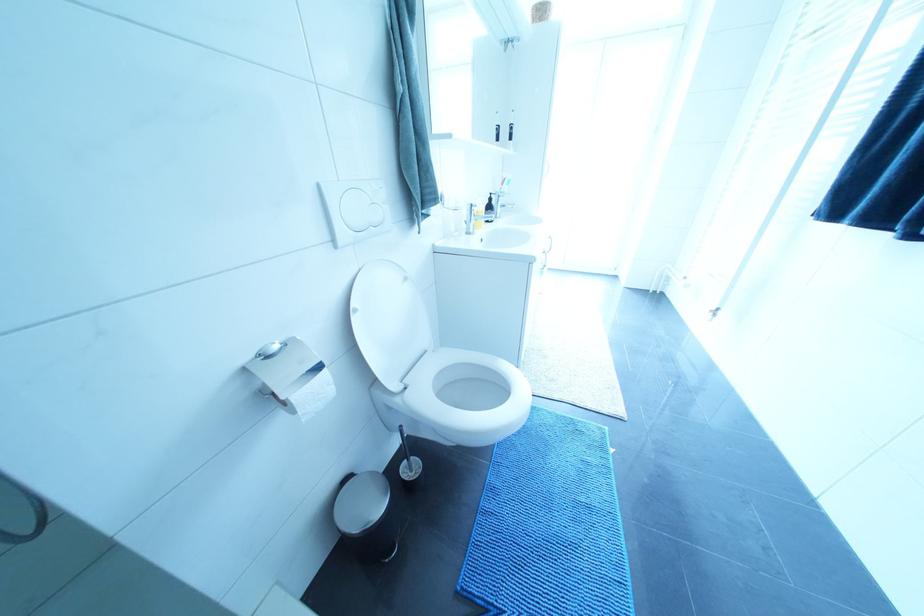
Where would you lift the white toilet lid? Please return your answer as a coordinate pair (x, y).

(388, 322)